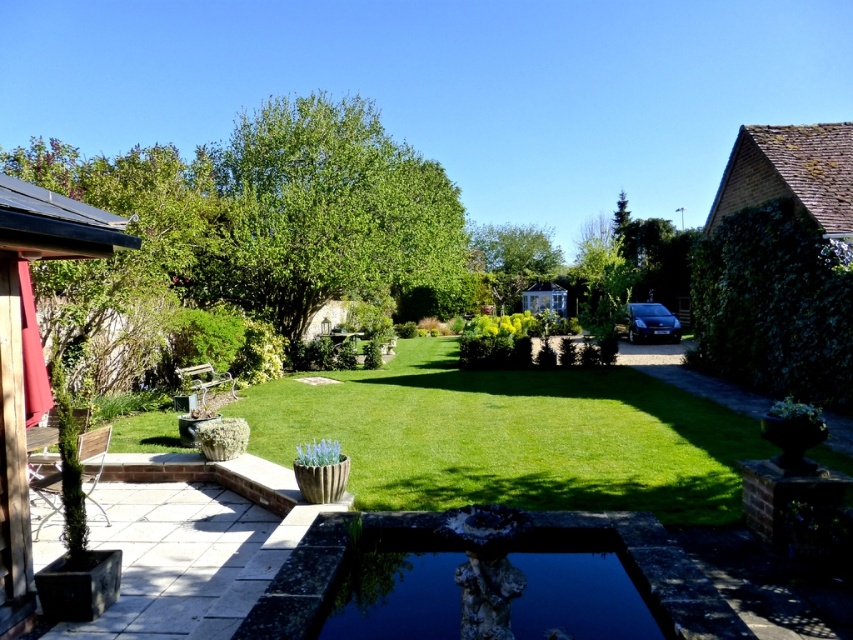
Question: Which of the following is the closest to the observer?

Choices:
 (A) smooth wooden terrace at left
 (B) dark stone water at center

Answer: (B)

Question: From the image, what is the correct spatial relationship of dark stone water at center in relation to smooth wooden terrace at left?

Choices:
 (A) above
 (B) below

Answer: (B)

Question: Can you confirm if dark stone water at center is positioned above smooth wooden terrace at left?

Choices:
 (A) no
 (B) yes

Answer: (A)

Question: Can you confirm if dark stone water at center is thinner than smooth wooden terrace at left?

Choices:
 (A) no
 (B) yes

Answer: (A)